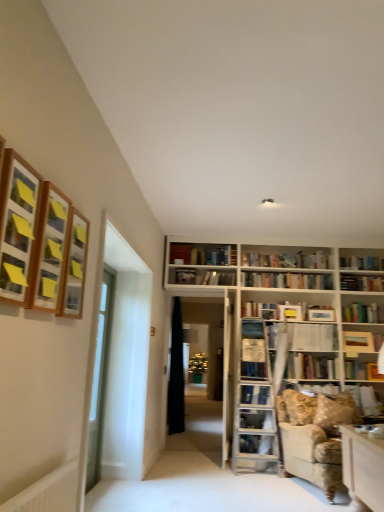
Question: Relative to clear glass door at left, marked as the first glass door in a right-to-left arrangement, is wooden framed picture at upper left, acting as the 3th shelf starting from the back, in front or behind?

Choices:
 (A) front
 (B) behind

Answer: (A)

Question: Would you say wooden framed picture at upper left, the first shelf viewed from the front, is inside or outside clear glass door at left, marked as the first glass door in a right-to-left arrangement?

Choices:
 (A) inside
 (B) outside

Answer: (B)

Question: Which object is the closest to the hardcover book at center, the 3th book in the top-to-bottom sequence?

Choices:
 (A) hardcover book at upper center, placed as the 1th book when sorted from top to bottom
 (B) hardcover book at lower right, marked as the 4th book in a top-to-bottom arrangement
 (C) wooden frame at upper left, the second shelf in the front-to-back sequence
 (D) floral fabric couch at lower right
 (E) black fabric curtain at center

Answer: (B)

Question: Which object is the closest to the clear glass door at left, marked as the first glass door in a right-to-left arrangement?

Choices:
 (A) black fabric curtain at center
 (B) wooden bookshelf at center
 (C) wooden bookshelf at upper center, the first book positioned from the back
 (D) hardcover book at lower right, marked as the 4th book in a top-to-bottom arrangement
 (E) hardcover book at upper center, arranged as the 3th book when viewed from the front

Answer: (A)